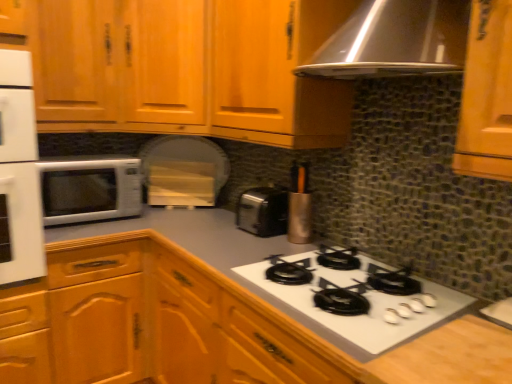
What is the approximate width of white glossy microwave at left?

The width of white glossy microwave at left is 14.33 inches.

Describe the element at coordinates (366, 296) in the screenshot. I see `white glossy gas stove at center` at that location.

Describe the element at coordinates (188, 68) in the screenshot. The height and width of the screenshot is (384, 512). I see `wooden cabinet at upper left, which is counted as the first cabinetry, starting from the top` at that location.

What is the approximate width of wooden cabinet at upper left, which is counted as the first cabinetry, starting from the top?

wooden cabinet at upper left, which is counted as the first cabinetry, starting from the top, is 24.48 inches wide.

Find the location of a particular element. white glossy sink at lower right is located at coordinates (499, 312).

In order to face satin silver toaster at center, should I rotate leftwards or rightwards?

To align with it, rotate right about 1.838°.

Where is `wooden cabinet at center, the 2th cabinetry in the top-to-bottom sequence`? wooden cabinet at center, the 2th cabinetry in the top-to-bottom sequence is located at coordinates (199, 328).

Who is taller, white glossy sink at lower right or satin silver toaster at center?

satin silver toaster at center is taller.

Is point (492, 316) closer or farther from the camera than point (277, 233)?

Point (492, 316).

Is white glossy sink at lower right turned away from satin silver toaster at center?

No.

Can you confirm if white glossy gas stove at center is thinner than white glossy microwave at left?

Incorrect, the width of white glossy gas stove at center is not less than that of white glossy microwave at left.

Considering the points (354, 334) and (78, 197), which point is in front, point (354, 334) or point (78, 197)?

Point (354, 334)

Is there a large distance between white glossy gas stove at center and white glossy microwave at left?

Yes, white glossy gas stove at center and white glossy microwave at left are located far from each other.

From the image's perspective, is white glossy gas stove at center below white glossy microwave at left?

Correct, white glossy gas stove at center appears lower than white glossy microwave at left in the image.

Can you tell me how much white glossy gas stove at center and satin silver toaster at center differ in facing direction?

white glossy gas stove at center and satin silver toaster at center are facing 0.000568 degrees away from each other.

From the picture: Which of these two, white glossy gas stove at center or satin silver toaster at center, stands shorter?

white glossy gas stove at center.

Is white glossy gas stove at center spatially inside satin silver toaster at center, or outside of it?

white glossy gas stove at center cannot be found inside satin silver toaster at center.

Which of these two, white glossy gas stove at center or satin silver toaster at center, is thinner?

satin silver toaster at center.

From a real-world perspective, is wooden cabinet at center, the 2th cabinetry in the top-to-bottom sequence, located higher than satin silver toaster at center?

No.

Where is `toaster above the wooden cabinet at center, the first cabinetry ordered from the bottom (from the image's perspective)`? The image size is (512, 384). toaster above the wooden cabinet at center, the first cabinetry ordered from the bottom (from the image's perspective) is located at coordinates (263, 211).

Would you say wooden cabinet at center, the 2th cabinetry in the top-to-bottom sequence, contains satin silver toaster at center?

That's incorrect, satin silver toaster at center is not inside wooden cabinet at center, the 2th cabinetry in the top-to-bottom sequence.

Is wooden cabinet at center, the first cabinetry ordered from the bottom, wider or thinner than metallic silver utensil holder at upper center?

In the image, wooden cabinet at center, the first cabinetry ordered from the bottom, appears to be wider than metallic silver utensil holder at upper center.

Is point (10, 297) more distant than point (291, 178)?

No.

Does wooden cabinet at center, the first cabinetry ordered from the bottom, appear on the left side of metallic silver utensil holder at upper center?

Correct, you'll find wooden cabinet at center, the first cabinetry ordered from the bottom, to the left of metallic silver utensil holder at upper center.

In the scene shown: Which is correct: wooden cabinet at center, the first cabinetry ordered from the bottom, is inside metallic silver utensil holder at upper center, or outside of it?

wooden cabinet at center, the first cabinetry ordered from the bottom, is spatially situated outside metallic silver utensil holder at upper center.

Considering the relative sizes of wooden cabinet at center, the 2th cabinetry in the top-to-bottom sequence, and white glossy gas stove at center in the image provided, is wooden cabinet at center, the 2th cabinetry in the top-to-bottom sequence, wider than white glossy gas stove at center?

Yes.

This screenshot has height=384, width=512. What are the coordinates of `gas stove located above the wooden cabinet at center, the first cabinetry ordered from the bottom (from the image's perspective)` in the screenshot? It's located at (366, 296).

Looking at this image, is there a large distance between wooden cabinet at center, the first cabinetry ordered from the bottom, and white glossy gas stove at center?

No, there isn't a large distance between wooden cabinet at center, the first cabinetry ordered from the bottom, and white glossy gas stove at center.

Considering the sizes of wooden cabinet at center, the 2th cabinetry in the top-to-bottom sequence, and white glossy gas stove at center in the image, is wooden cabinet at center, the 2th cabinetry in the top-to-bottom sequence, bigger or smaller than white glossy gas stove at center?

Clearly, wooden cabinet at center, the 2th cabinetry in the top-to-bottom sequence, is larger in size than white glossy gas stove at center.

From a real-world perspective, is satin silver toaster at center located higher than wooden cabinet at center, the 2th cabinetry in the top-to-bottom sequence?

Correct, in the physical world, satin silver toaster at center is higher than wooden cabinet at center, the 2th cabinetry in the top-to-bottom sequence.

Does satin silver toaster at center appear on the right side of wooden cabinet at center, the first cabinetry ordered from the bottom?

Incorrect, satin silver toaster at center is not on the right side of wooden cabinet at center, the first cabinetry ordered from the bottom.

Considering their positions, is satin silver toaster at center located in front of or behind wooden cabinet at center, the first cabinetry ordered from the bottom?

In the image, satin silver toaster at center appears behind wooden cabinet at center, the first cabinetry ordered from the bottom.

From the image's perspective, is satin silver toaster at center under wooden cabinet at center, the 2th cabinetry in the top-to-bottom sequence?

Incorrect, from the image's perspective, satin silver toaster at center is higher than wooden cabinet at center, the 2th cabinetry in the top-to-bottom sequence.

Where is `toaster on the left of white glossy sink at lower right`? The width and height of the screenshot is (512, 384). toaster on the left of white glossy sink at lower right is located at coordinates (263, 211).

Locate an element on the screen. Image resolution: width=512 pixels, height=384 pixels. microwave oven that appears above the white glossy gas stove at center (from a real-world perspective) is located at coordinates (90, 189).

Looking at the image, which one is located closer to white glossy microwave at left, wooden cabinet at upper left, acting as the second cabinetry starting from the bottom, or metallic silver utensil holder at upper center?

wooden cabinet at upper left, acting as the second cabinetry starting from the bottom.

Looking at the image, which one is located further to wooden cabinet at center, the 2th cabinetry in the top-to-bottom sequence, white glossy microwave at left or white glossy sink at lower right?

white glossy sink at lower right is further to wooden cabinet at center, the 2th cabinetry in the top-to-bottom sequence.

Which object lies nearer to the anchor point white glossy sink at lower right, metallic silver utensil holder at upper center or white glossy gas stove at center?

white glossy gas stove at center lies closer to white glossy sink at lower right than the other object.

From the image, which object appears to be nearer to wooden cabinet at upper left, which is counted as the first cabinetry, starting from the top, wooden cabinet at center, the first cabinetry ordered from the bottom, or white glossy microwave at left?

The object closer to wooden cabinet at upper left, which is counted as the first cabinetry, starting from the top, is white glossy microwave at left.

Looking at the image, which one is located closer to white glossy sink at lower right, metallic silver utensil holder at upper center or white glossy microwave at left?

The object closer to white glossy sink at lower right is metallic silver utensil holder at upper center.

Considering their positions, is wooden cabinet at upper left, acting as the second cabinetry starting from the bottom, positioned further to metallic silver utensil holder at upper center than satin silver toaster at center?

wooden cabinet at upper left, acting as the second cabinetry starting from the bottom, lies further to metallic silver utensil holder at upper center than the other object.

From the image, which object appears to be nearer to white glossy sink at lower right, wooden cabinet at upper left, which is counted as the first cabinetry, starting from the top, or satin silver toaster at center?

satin silver toaster at center is positioned closer to the anchor white glossy sink at lower right.

From the image, which object appears to be nearer to satin silver toaster at center, wooden cabinet at upper left, which is counted as the first cabinetry, starting from the top, or metallic silver utensil holder at upper center?

metallic silver utensil holder at upper center.

Find the location of `toaster located between white glossy microwave at left and metallic silver utensil holder at upper center in the left-right direction`. toaster located between white glossy microwave at left and metallic silver utensil holder at upper center in the left-right direction is located at coordinates (263, 211).

You are a GUI agent. You are given a task and a screenshot of the screen. Output one action in this format:
    pyautogui.click(x=<x>, y=<y>)
    Task: Click on the toaster between wooden cabinet at upper left, acting as the second cabinetry starting from the bottom, and wooden cabinet at center, the 2th cabinetry in the top-to-bottom sequence, in the up-down direction
    
    Given the screenshot: What is the action you would take?
    pyautogui.click(x=263, y=211)

I want to click on kitchen appliance between white glossy microwave at left and white glossy gas stove at center in the horizontal direction, so click(x=298, y=206).

Where is `sink between wooden cabinet at upper left, acting as the second cabinetry starting from the bottom, and wooden cabinet at center, the 2th cabinetry in the top-to-bottom sequence, vertically`? The image size is (512, 384). sink between wooden cabinet at upper left, acting as the second cabinetry starting from the bottom, and wooden cabinet at center, the 2th cabinetry in the top-to-bottom sequence, vertically is located at coordinates (499, 312).